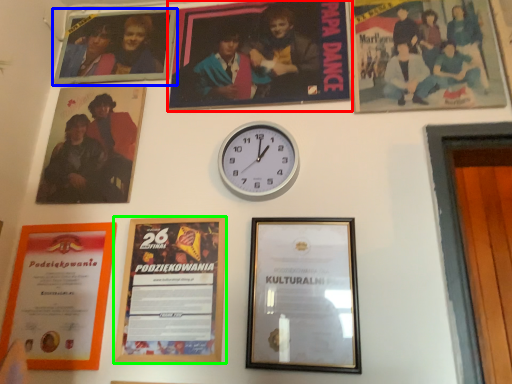
Question: Which is nearer to the picture frame (highlighted by a red box)? picture frame (highlighted by a blue box) or picture frame (highlighted by a green box).

Choices:
 (A) picture frame
 (B) picture frame

Answer: (A)